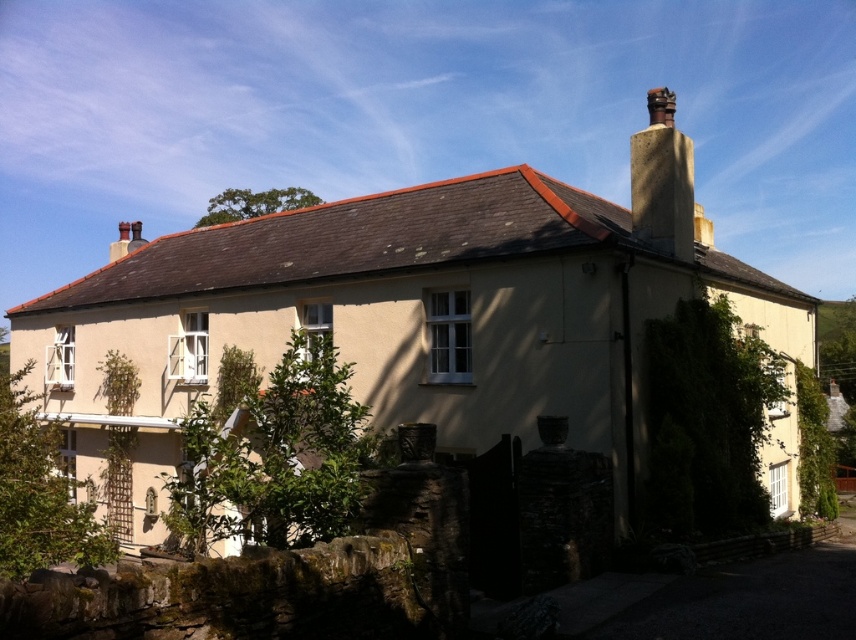
Based on the scene description, can you determine the relative position of the beige stucco cottage at center and the smooth stone chimney at upper right? Specifically, which one is positioned to the left?

The beige stucco cottage at center is to the left of the smooth stone chimney at upper right.

You are standing in front of the beige stucco cottage at center and looking towards the smooth stone chimney at upper right. Which object is higher in the image?

The smooth stone chimney at upper right is higher than the beige stucco cottage at center in the image.